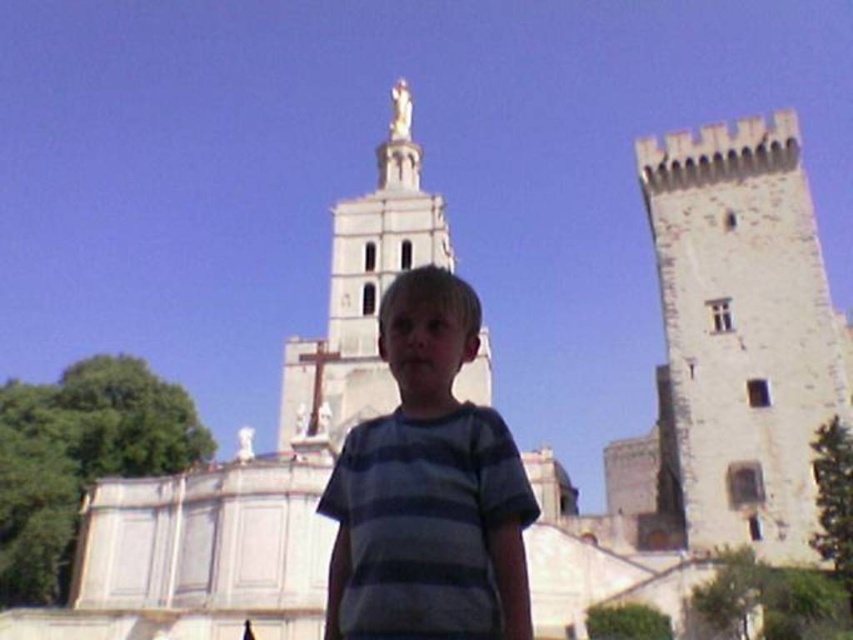
Question: Among these points, which one is nearest to the camera?

Choices:
 (A) (404, 316)
 (B) (387, 284)

Answer: (A)

Question: Can you confirm if striped cotton shirt at center is bigger than white stone tower at center?

Choices:
 (A) no
 (B) yes

Answer: (A)

Question: Among these objects, which one is nearest to the camera?

Choices:
 (A) striped cotton shirt at center
 (B) white stone tower at center

Answer: (A)

Question: Does striped cotton shirt at center come in front of white stone tower at center?

Choices:
 (A) no
 (B) yes

Answer: (B)

Question: In this image, where is striped cotton shirt at center located relative to white stone tower at center?

Choices:
 (A) above
 (B) below

Answer: (B)